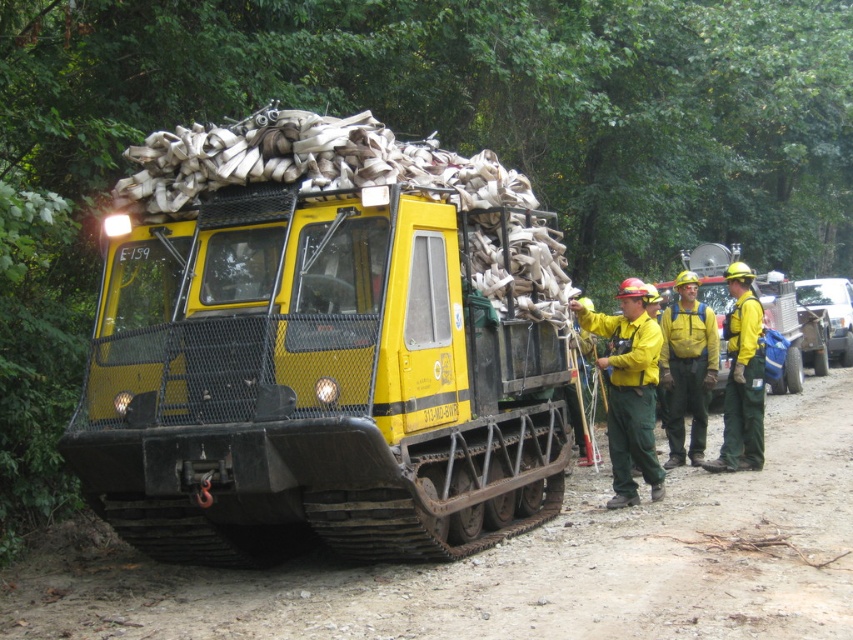
You are a safety inspector evaluating the scene. The yellow matte truck at center is carrying sandbags on its roof. According to safety protocols, the height of the sandbag stack must not exceed the height of the yellow hard hat at center placed on the ground. Can you determine if the sandbags comply with this regulation?

The yellow matte truck at center is larger in size than the yellow hard hat at center. Since the truck itself is larger, the sandbag stack on its roof likely exceeds the height restriction based on the hard hat, so it does not comply with the safety protocols.